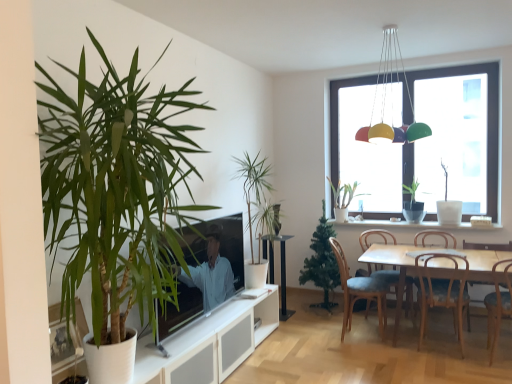
The width and height of the screenshot is (512, 384). I want to click on vacant space in between wooden chair at lower right, positioned as the 3th chair in right-to-left order, and white glossy table at lower right, so click(x=408, y=351).